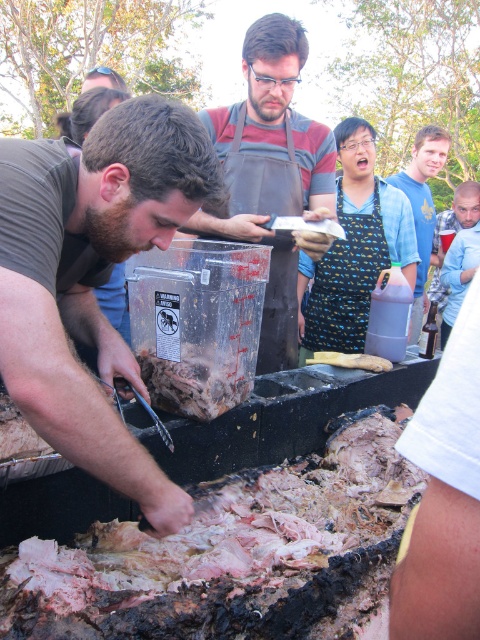
Question: Which of the following is the closest to the observer?

Choices:
 (A) (129, 141)
 (B) (427, 301)
 (C) (192, 387)
 (D) (475, 424)

Answer: (D)

Question: Does matte black apron at center appear under yellowish matte wood at center?

Choices:
 (A) no
 (B) yes

Answer: (A)

Question: Does matte black apron at center have a greater width compared to blue shirt at center?

Choices:
 (A) yes
 (B) no

Answer: (B)

Question: Observing the image, what is the correct spatial positioning of matte black apron at center in reference to blue shirt at center?

Choices:
 (A) above
 (B) below

Answer: (B)

Question: Which of the following is the closest to the observer?

Choices:
 (A) (347, 358)
 (B) (199, 412)

Answer: (B)

Question: Among these points, which one is nearest to the camera?

Choices:
 (A) (400, 472)
 (B) (462, 484)

Answer: (B)